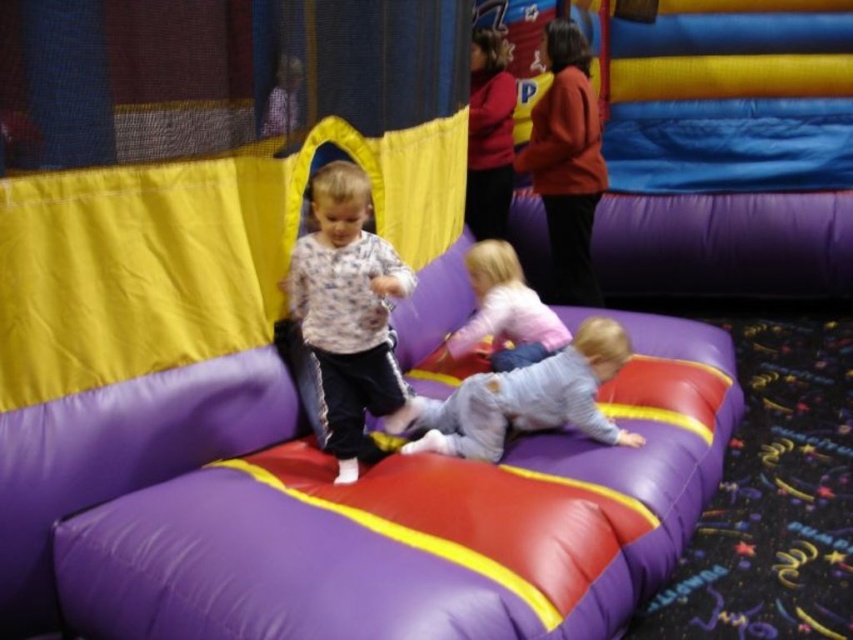
You are a parent trying to locate your child in the play area. You see the fluffy white sweater at center and the gray fabric boy at lower center. Which object is closer to the other child?

The fluffy white sweater at center is 19.21 inches away from the gray fabric boy at lower center, so they are relatively close to each other.

You are a photographer positioned in front of the bouncy castle. You want to take a photo that includes both the point at (445, 444) and the point at (526, 314). Which point should you focus on first to ensure both are in sharp focus?

You should focus on the point at (526, 314) first because it is farther from the viewer compared to the point at (445, 444). By focusing on the farther point, the closer point will also be within the depth of field, ensuring both are in sharp focus.

You are a parent trying to decide which item to place on the bouncy castle first. The fluffy white sweater at center and the gray fabric boy at lower center are both on the ground. Which item has a smaller width when viewed from above?

The fluffy white sweater at center is thinner than the gray fabric boy at lower center, so the fluffy white sweater at center has a smaller width when viewed from above.